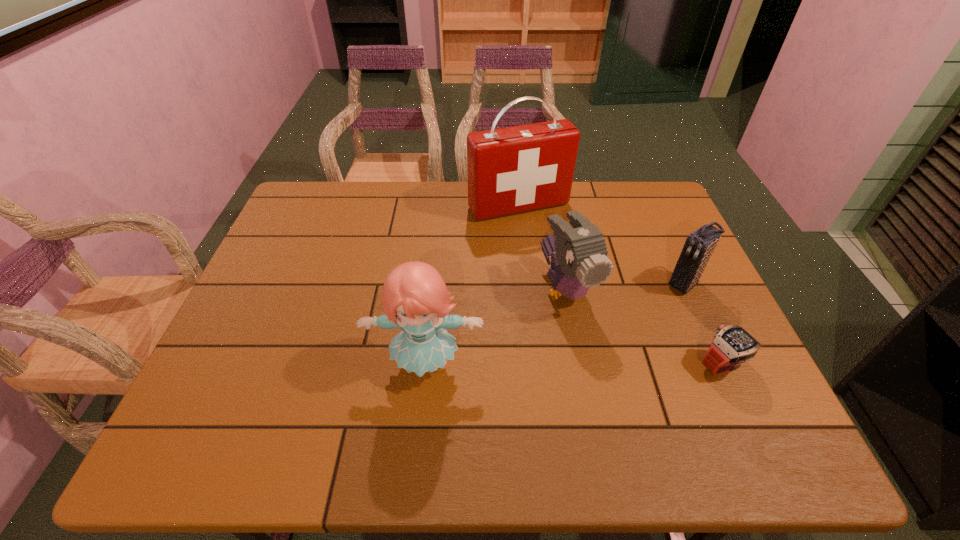
Where is `object that is positioned at the near right corner`? This screenshot has width=960, height=540. object that is positioned at the near right corner is located at coordinates (733, 345).

Find the location of `vacant space at the far edge of the desktop`. vacant space at the far edge of the desktop is located at coordinates (583, 193).

In the image, there is a desktop. In order to click on vacant region at the near edge in this screenshot , I will do `click(405, 379)`.

Find the location of a particular element. vacant space at the left edge of the desktop is located at coordinates click(x=271, y=256).

Find the location of a particular element. This screenshot has width=960, height=540. vacant position at the right edge of the desktop is located at coordinates (698, 290).

Where is `blank space at the far left corner of the desktop`? The height and width of the screenshot is (540, 960). blank space at the far left corner of the desktop is located at coordinates (327, 200).

In order to click on free location at the far right corner in this screenshot , I will do `click(634, 184)`.

You are a GUI agent. You are given a task and a screenshot of the screen. Output one action in this format:
    pyautogui.click(x=<x>, y=<y>)
    Task: Click on the blank space at the near right corner of the desktop
    
    Given the screenshot: What is the action you would take?
    point(703,394)

I want to click on vacant area between the clutch bag and the shortest object, so click(704, 325).

Where is `free space between the doll and the bird`? The width and height of the screenshot is (960, 540). free space between the doll and the bird is located at coordinates (x=496, y=327).